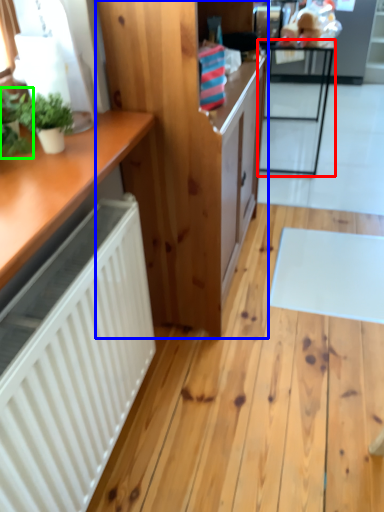
Question: Estimate the real-world distances between objects in this image. Which object is farther from table (highlighted by a red box), cabinetry (highlighted by a blue box) or houseplant (highlighted by a green box)?

Choices:
 (A) cabinetry
 (B) houseplant

Answer: (B)